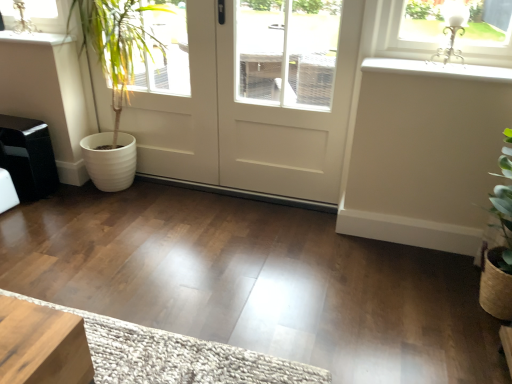
Question: In the image, is white glossy window sill at upper left, which is the 2th window sill from right to left, positioned in front of or behind white ribbed pot at left?

Choices:
 (A) front
 (B) behind

Answer: (B)

Question: Looking at the image, does white glossy window sill at upper left, which ranks as the second window sill in bottom-to-top order, seem bigger or smaller compared to white ribbed pot at left?

Choices:
 (A) big
 (B) small

Answer: (B)

Question: Which is nearer to the white ribbed pot at left?

Choices:
 (A) white matte door at center
 (B) white smooth window sill at upper right, which appears as the 2th window sill when viewed from the top
 (C) white glossy window sill at upper left, the 1th window sill positioned from the back
 (D) white textured doormat at lower center

Answer: (C)

Question: Which object is positioned closest to the white matte door at center?

Choices:
 (A) white textured doormat at lower center
 (B) white ribbed pot at left
 (C) white glossy window sill at upper left, the first window sill positioned from the top
 (D) white smooth window sill at upper right, arranged as the first window sill when viewed from the front

Answer: (B)